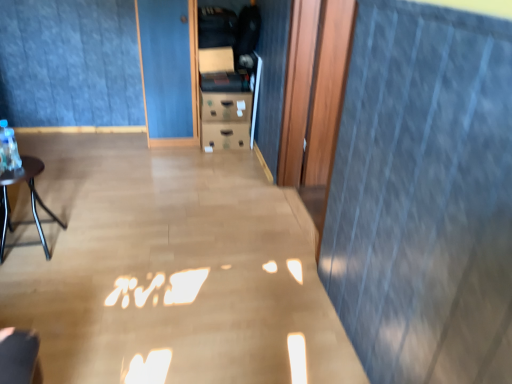
At what (x,y) coordinates should I click in order to perform the action: click on space that is in front of matte black table at left. Please return your answer as a coordinate pair (x, y). The width and height of the screenshot is (512, 384). Looking at the image, I should click on (30, 280).